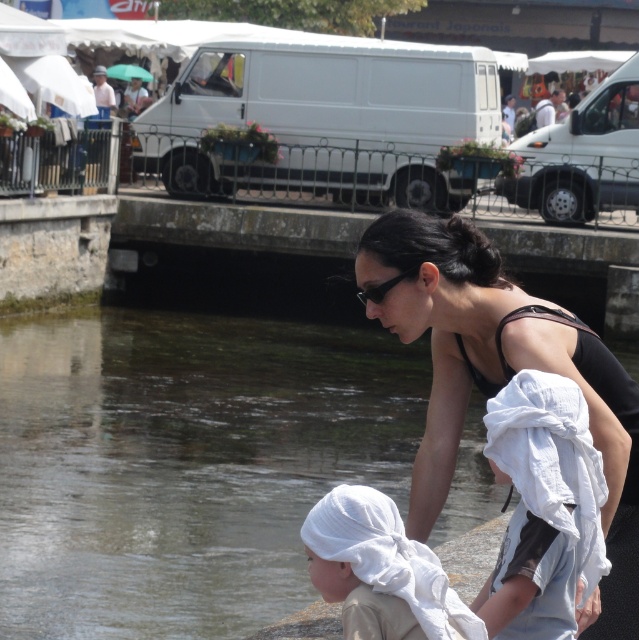
Question: Which is nearer to the white cotton towel at lower left?

Choices:
 (A) white cotton towel at lower center
 (B) black matte tank top at upper center

Answer: (A)

Question: Is white cotton towel at lower center above white cotton towel at lower left?

Choices:
 (A) yes
 (B) no

Answer: (A)

Question: Can you confirm if black matte tank top at upper center is smaller than white cotton towel at lower center?

Choices:
 (A) no
 (B) yes

Answer: (A)

Question: Which of the following is the closest to the observer?

Choices:
 (A) (636, 611)
 (B) (587, 595)

Answer: (B)

Question: Is black matte tank top at upper center below white cotton towel at lower center?

Choices:
 (A) no
 (B) yes

Answer: (A)

Question: Which of the following is the farthest from the observer?

Choices:
 (A) black matte tank top at upper center
 (B) white cotton towel at lower left
 (C) white cotton towel at lower center

Answer: (A)